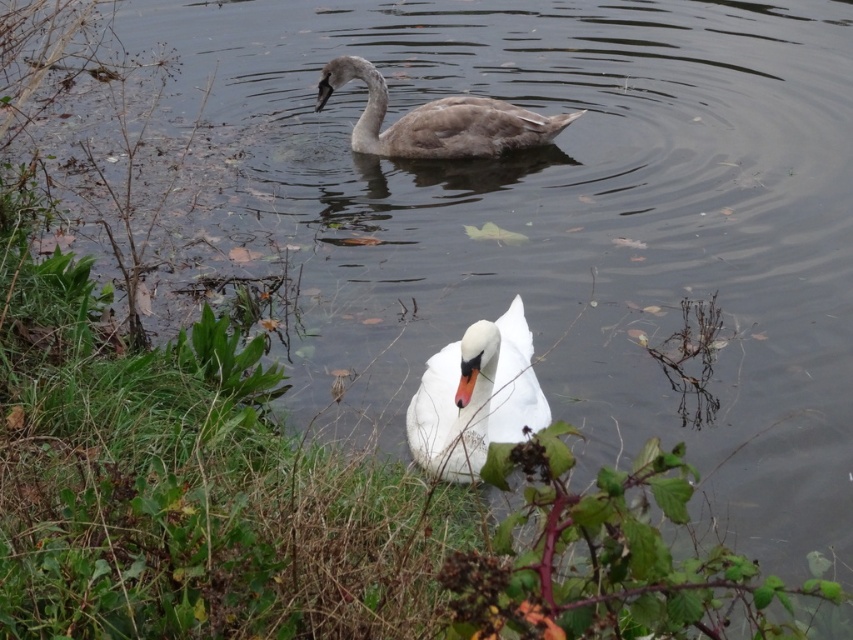
Question: Which of the following is the closest to the observer?

Choices:
 (A) (364, 108)
 (B) (419, 451)

Answer: (B)

Question: Which point appears closest to the camera in this image?

Choices:
 (A) (456, 141)
 (B) (479, 456)

Answer: (B)

Question: Among these objects, which one is farthest from the camera?

Choices:
 (A) white glossy swan at center
 (B) gray matte swan at upper center

Answer: (B)

Question: Is white glossy swan at center above gray matte swan at upper center?

Choices:
 (A) yes
 (B) no

Answer: (B)

Question: Can you confirm if white glossy swan at center is thinner than gray matte swan at upper center?

Choices:
 (A) yes
 (B) no

Answer: (A)

Question: Does white glossy swan at center appear on the left side of gray matte swan at upper center?

Choices:
 (A) no
 (B) yes

Answer: (A)